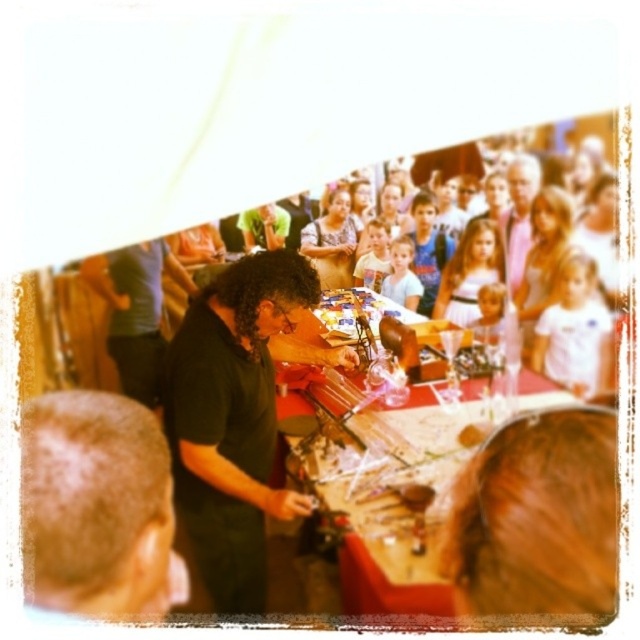
Image resolution: width=640 pixels, height=640 pixels. What do you see at coordinates (232, 419) in the screenshot?
I see `black matte shirt at center` at bounding box center [232, 419].

Which is above, black matte shirt at center or matte gray shirt at upper center?

matte gray shirt at upper center

Who is more distant from viewer, (x=225, y=586) or (x=531, y=157)?

Point (x=225, y=586)

The height and width of the screenshot is (640, 640). In order to click on black matte shirt at center in this screenshot , I will do `click(232, 419)`.

Is black matte shirt at center bigger than gray hair at lower left?

Yes, black matte shirt at center is bigger than gray hair at lower left.

Is black matte shirt at center positioned behind gray hair at lower left?

That is True.

This screenshot has width=640, height=640. I want to click on black matte shirt at center, so click(x=232, y=419).

In order to click on gray hair at lower left in this screenshot , I will do `click(97, 508)`.

Does gray hair at lower left have a lesser height compared to matte gray shirt at upper center?

No.

Is point (44, 419) farther from camera compared to point (509, 257)?

No, it is not.

Locate an element on the screen. Image resolution: width=640 pixels, height=640 pixels. gray hair at lower left is located at coordinates click(97, 508).